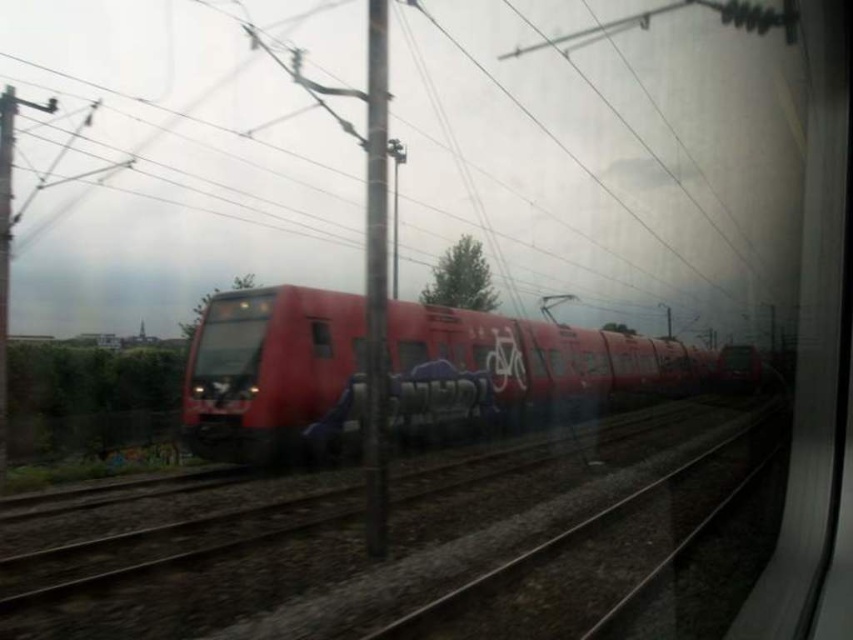
Is transparent glass train at center to the left of transparent glass window at center from the viewer's perspective?

In fact, transparent glass train at center is to the right of transparent glass window at center.

Which is in front, point (415, 356) or point (329, 340)?

Point (329, 340) is in front.

Find the location of a particular element. This screenshot has width=853, height=640. transparent glass train at center is located at coordinates (410, 353).

In the scene shown: Between matte red train at center and transparent glass window at center, which one appears on the right side from the viewer's perspective?

matte red train at center

How much distance is there between matte red train at center and transparent glass window at center?

They are 6.65 meters apart.

The height and width of the screenshot is (640, 853). What do you see at coordinates (524, 368) in the screenshot?
I see `matte red train at center` at bounding box center [524, 368].

At what (x,y) coordinates should I click in order to perform the action: click on matte red train at center. Please return your answer as a coordinate pair (x, y). The width and height of the screenshot is (853, 640). Looking at the image, I should click on (524, 368).

Who is higher up, metallic pole at center or transparent glass train at center?

metallic pole at center is higher up.

Does point (381, 515) lie in front of point (403, 344)?

That is True.

This screenshot has height=640, width=853. I want to click on metallic pole at center, so click(376, 284).

Identify the location of metallic pole at center. This screenshot has height=640, width=853. (376, 284).